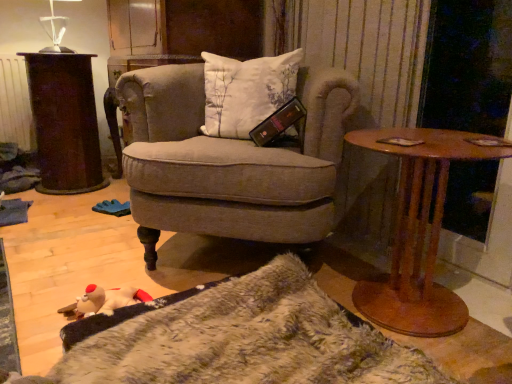
This screenshot has width=512, height=384. In order to click on vacant region to the left of textured beige armchair at center in this screenshot , I will do `click(73, 254)`.